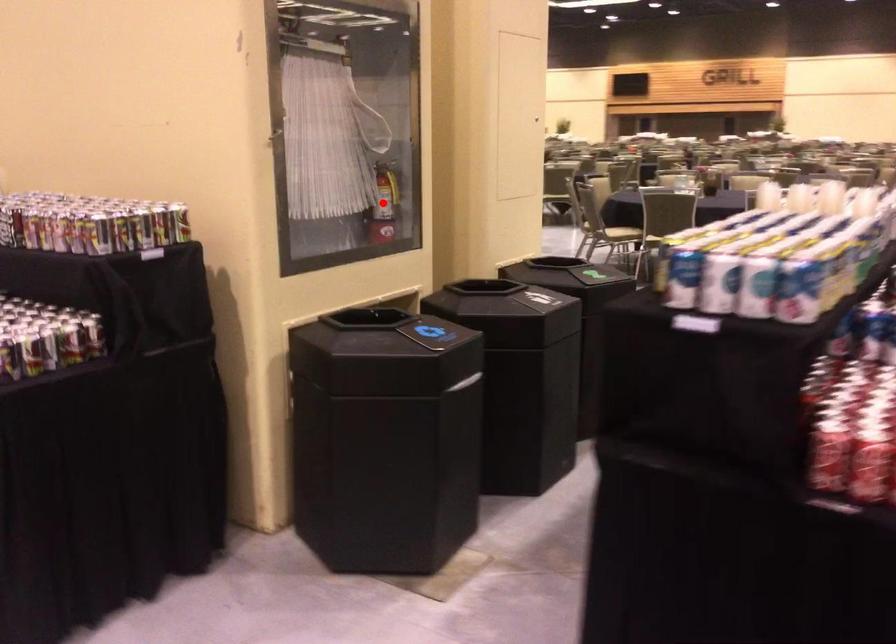
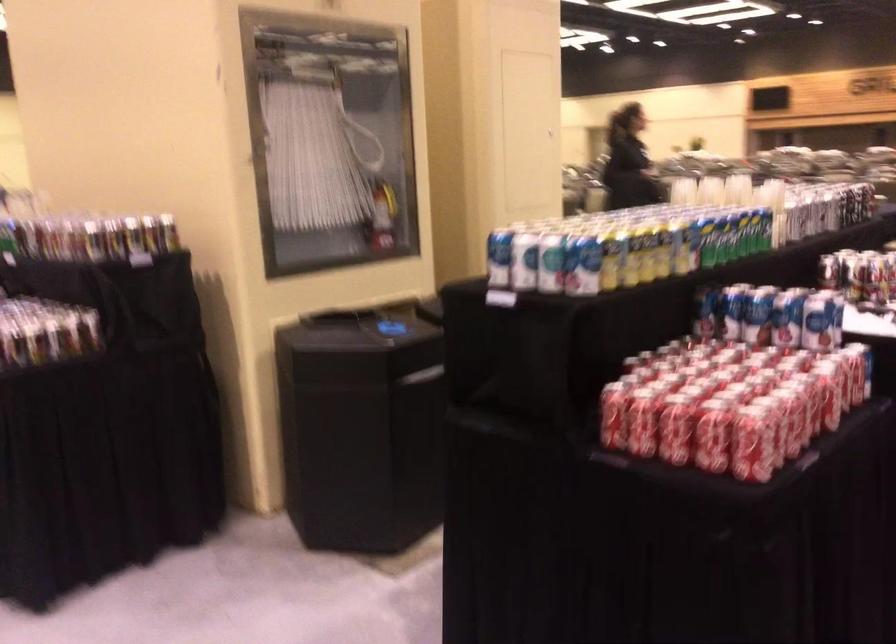
Locate, in the second image, the point that corresponds to the highlighted location in the first image.

(382, 216)